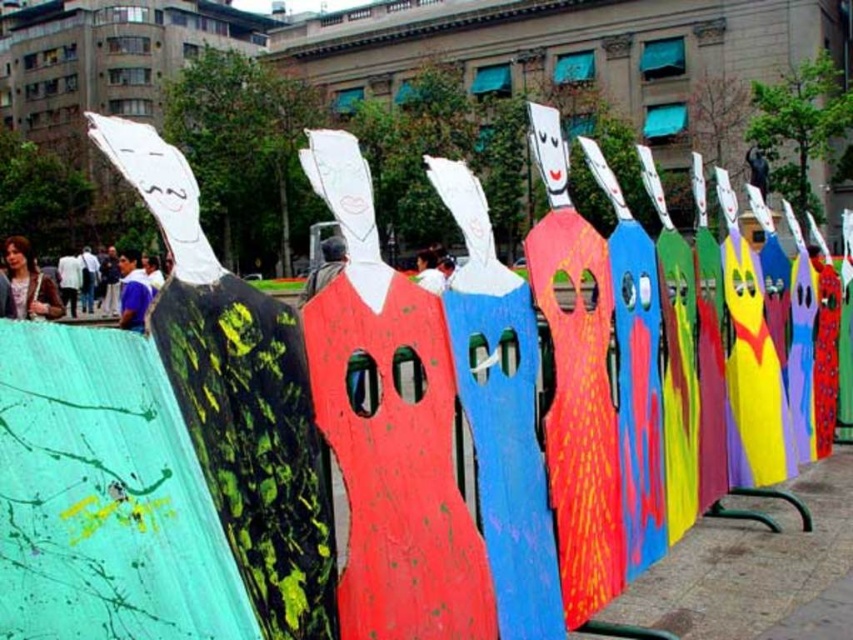
Does point (45, 284) lie in front of point (74, 316)?

Yes, point (45, 284) is in front of point (74, 316).

Does matte brown hair at left have a greater height compared to white cotton shirt at center?

Indeed, matte brown hair at left has a greater height compared to white cotton shirt at center.

Identify the location of matte brown hair at left. (28, 284).

I want to click on matte brown hair at left, so click(x=28, y=284).

Is blue cotton shirt at center above matte gray jacket at center?

No, blue cotton shirt at center is not above matte gray jacket at center.

Which of these two, blue cotton shirt at center or matte gray jacket at center, stands taller?

blue cotton shirt at center is taller.

This screenshot has height=640, width=853. What are the coordinates of `blue cotton shirt at center` in the screenshot? It's located at (132, 291).

Who is shorter, blue cotton shirt at center or white cotton shirt at center?

With less height is white cotton shirt at center.

Identify the location of blue cotton shirt at center. (132, 291).

You are a GUI agent. You are given a task and a screenshot of the screen. Output one action in this format:
    pyautogui.click(x=<x>, y=<y>)
    Task: Click on the blue cotton shirt at center
    This screenshot has width=853, height=640.
    Given the screenshot: What is the action you would take?
    pyautogui.click(x=132, y=291)